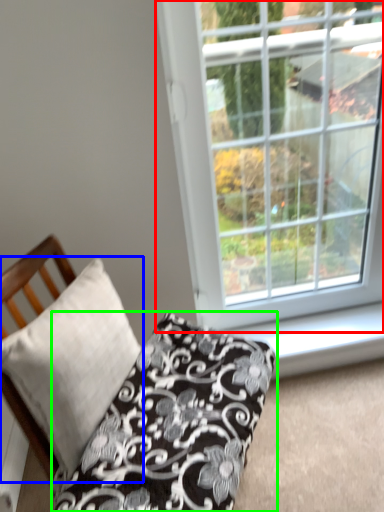
Question: Estimate the real-world distances between objects in this image. Which object is closer to window (highlighted by a red box), pillow (highlighted by a blue box) or pillow (highlighted by a green box)?

Choices:
 (A) pillow
 (B) pillow

Answer: (B)